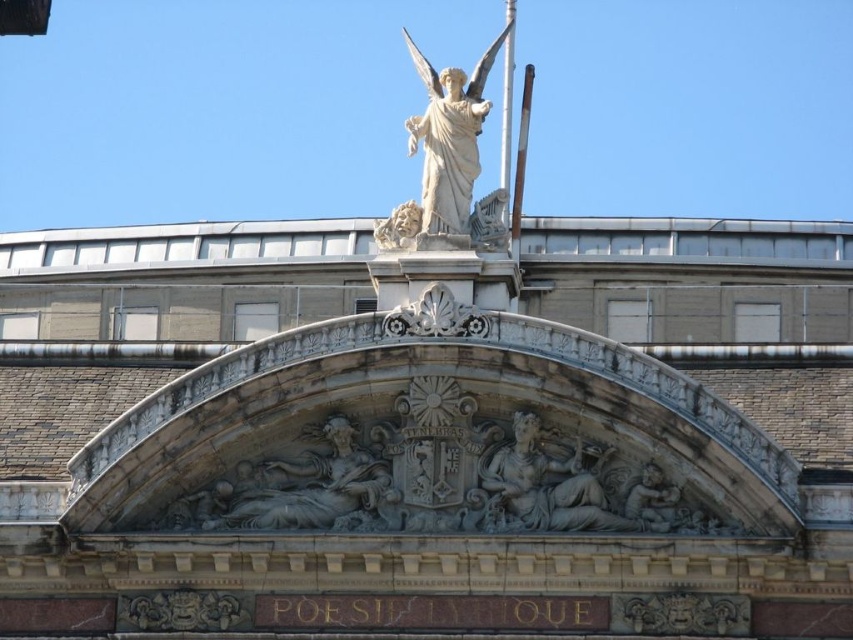
Is white marble statue at upper center further to camera compared to white polished metal pole at upper center?

That is False.

Is white marble statue at upper center to the left of white polished metal pole at upper center from the viewer's perspective?

Correct, you'll find white marble statue at upper center to the left of white polished metal pole at upper center.

Which is in front, point (421, 65) or point (529, 72)?

Positioned in front is point (421, 65).

The width and height of the screenshot is (853, 640). I want to click on white marble statue at upper center, so pos(448,164).

Which is above, white marble statue at upper center or white stone cherub at upper center?

white marble statue at upper center

Consider the image. Does white marble statue at upper center lie in front of white stone cherub at upper center?

Yes, it is.

What do you see at coordinates (448, 164) in the screenshot? I see `white marble statue at upper center` at bounding box center [448, 164].

The width and height of the screenshot is (853, 640). I want to click on white marble statue at upper center, so click(x=448, y=164).

Does point (561, 492) lie behind point (503, 147)?

That is False.

Between gray stone reclining figure at center and metallic flagpole at upper center, which one appears on the right side from the viewer's perspective?

Positioned to the right is gray stone reclining figure at center.

You are a GUI agent. You are given a task and a screenshot of the screen. Output one action in this format:
    pyautogui.click(x=<x>, y=<y>)
    Task: Click on the gray stone reclining figure at center
    
    Given the screenshot: What is the action you would take?
    pyautogui.click(x=547, y=483)